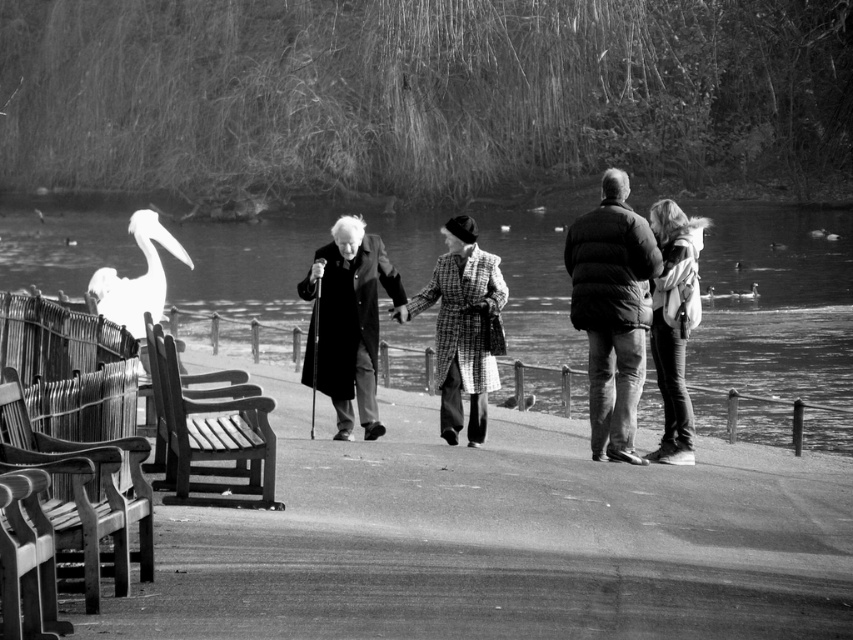
You are planning to sit on the wooden park bench at left or the denim jacket at right. Which one is larger in size?

The wooden park bench at left is bigger than the denim jacket at right, so the wooden park bench at left is larger in size.

Consider the image. Based on the scene description, where is the wooden park bench at left located in the image?

The wooden park bench at left is located at the point with coordinates 0.678 and 0.247 in the image.